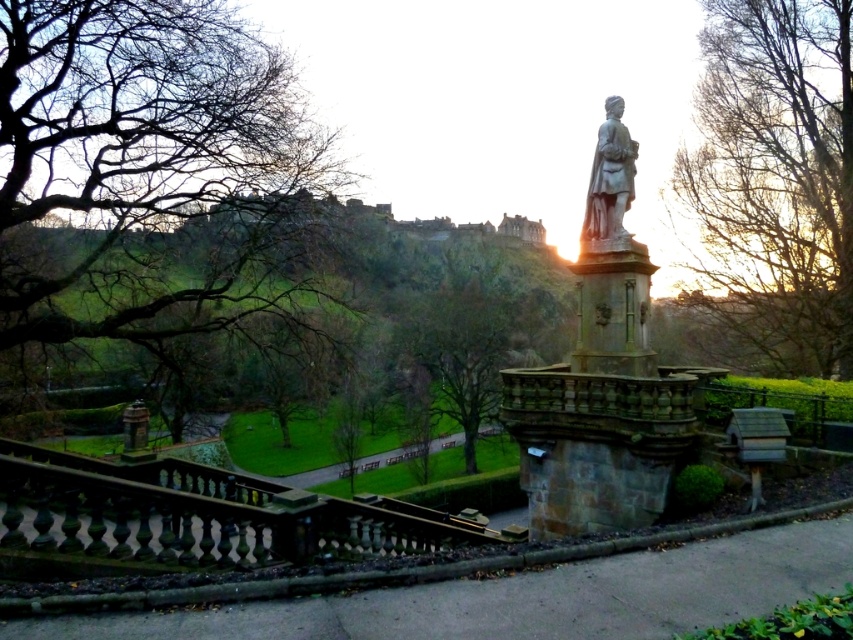
Is point (193, 118) positioned behind point (604, 179)?

Yes, point (193, 118) is behind point (604, 179).

This screenshot has height=640, width=853. What do you see at coordinates (149, 172) in the screenshot?
I see `bare branches at upper left` at bounding box center [149, 172].

Where is `bare branches at upper left`? This screenshot has width=853, height=640. bare branches at upper left is located at coordinates (149, 172).

In order to click on bare branches at upper left in this screenshot , I will do `click(149, 172)`.

Can you confirm if bare branches at upper right is positioned below gray stone statue at center?

No, bare branches at upper right is not below gray stone statue at center.

Does bare branches at upper right have a larger size compared to gray stone statue at center?

Correct, bare branches at upper right is larger in size than gray stone statue at center.

Who is more forward, (819, 113) or (610, 150)?

Positioned in front is point (610, 150).

Find the location of a particular element. The image size is (853, 640). bare branches at upper right is located at coordinates pyautogui.click(x=775, y=177).

Between point (73, 310) and point (772, 56), which one is positioned behind?

The point (772, 56) is behind.

Which is below, bare branches at upper left or bare branches at upper right?

bare branches at upper left is below.

Image resolution: width=853 pixels, height=640 pixels. What do you see at coordinates (149, 172) in the screenshot?
I see `bare branches at upper left` at bounding box center [149, 172].

You are a GUI agent. You are given a task and a screenshot of the screen. Output one action in this format:
    pyautogui.click(x=<x>, y=<y>)
    Task: Click on the bare branches at upper left
    The width and height of the screenshot is (853, 640).
    Given the screenshot: What is the action you would take?
    pyautogui.click(x=149, y=172)